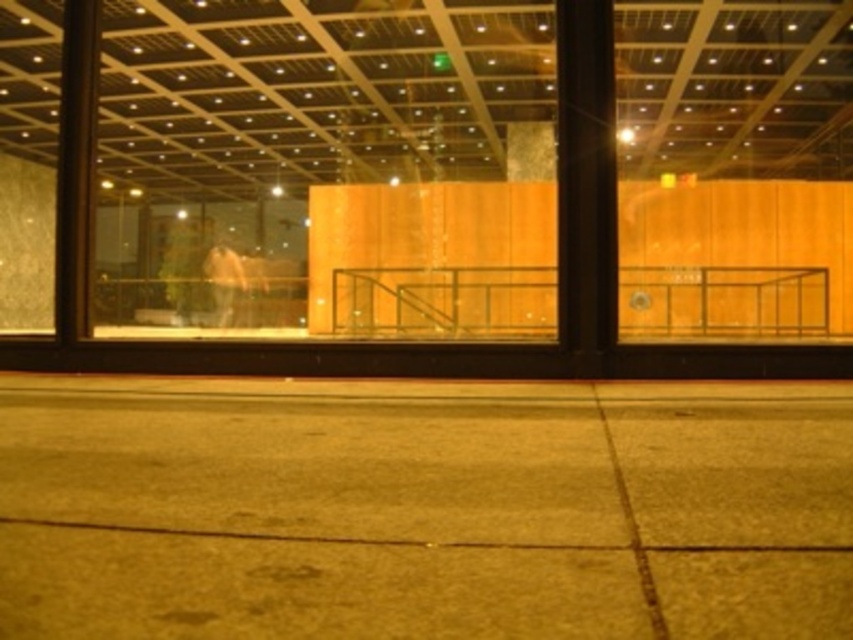
Which is above, concrete pavement at center or light brown leather jacket at center?

light brown leather jacket at center

Is point (519, 440) in front of point (202, 273)?

Yes, it is in front of point (202, 273).

This screenshot has height=640, width=853. Identify the location of concrete pavement at center. (422, 508).